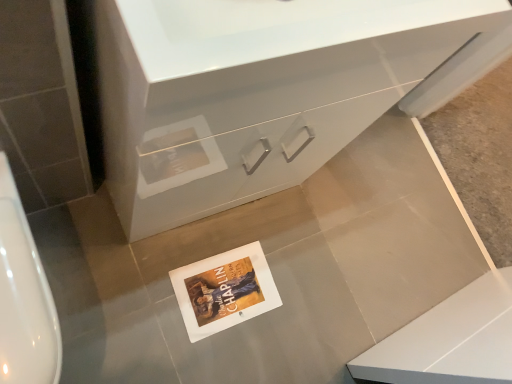
Where is `free spot in front of white paper postcard at center`? This screenshot has width=512, height=384. free spot in front of white paper postcard at center is located at coordinates (164, 340).